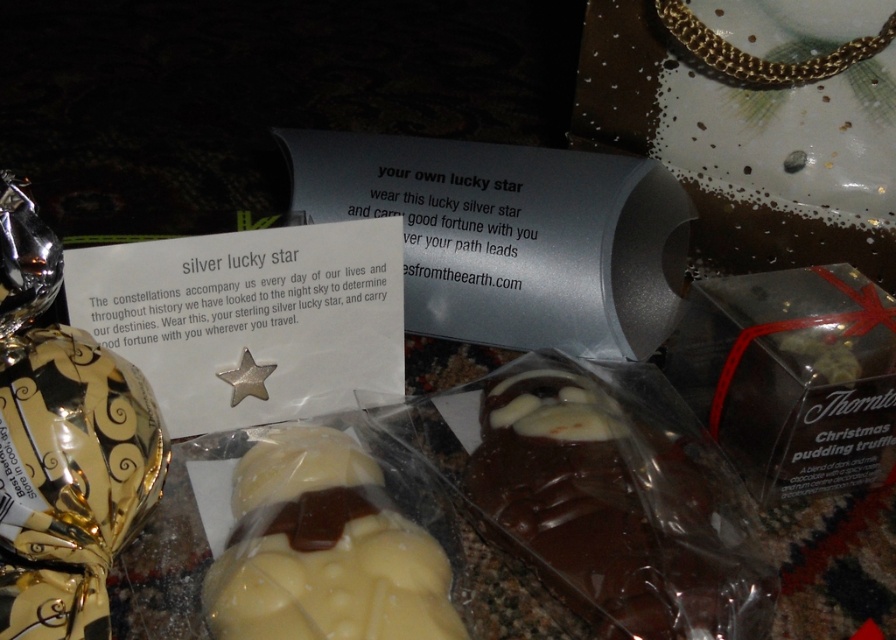
Question: Is gold foil wrapped chocolate at lower left to the left of white chocolate at center from the viewer's perspective?

Choices:
 (A) yes
 (B) no

Answer: (A)

Question: Can you confirm if dark chocolate truffle at center is bigger than white chocolate at center?

Choices:
 (A) yes
 (B) no

Answer: (A)

Question: Among these objects, which one is nearest to the camera?

Choices:
 (A) gold foil wrapped chocolate at lower left
 (B) dark chocolate truffle at center
 (C) white chocolate at center

Answer: (A)

Question: Does gold foil wrapped chocolate at lower left have a larger size compared to white chocolate at center?

Choices:
 (A) yes
 (B) no

Answer: (B)

Question: Which of the following is the farthest from the observer?

Choices:
 (A) (560, 572)
 (B) (4, 400)

Answer: (A)

Question: Which point is closer to the camera taking this photo?

Choices:
 (A) (722, 572)
 (B) (256, 556)
 (C) (104, 403)

Answer: (C)